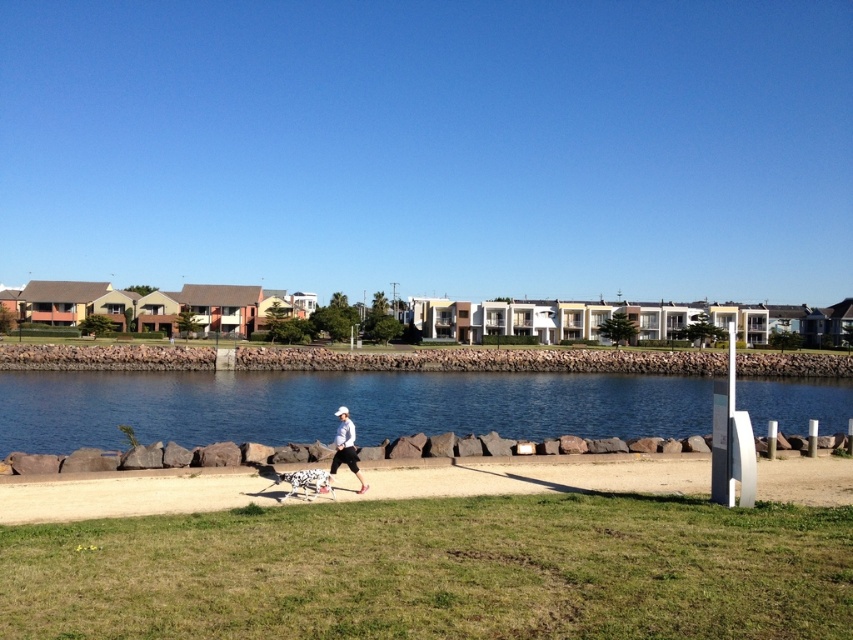
Question: Does blue stone water at center have a greater width compared to white matte jacket at center?

Choices:
 (A) no
 (B) yes

Answer: (B)

Question: Is blue stone water at center smaller than white matte jacket at center?

Choices:
 (A) yes
 (B) no

Answer: (B)

Question: Can you confirm if blue stone water at center is positioned below white matte jacket at center?

Choices:
 (A) no
 (B) yes

Answer: (B)